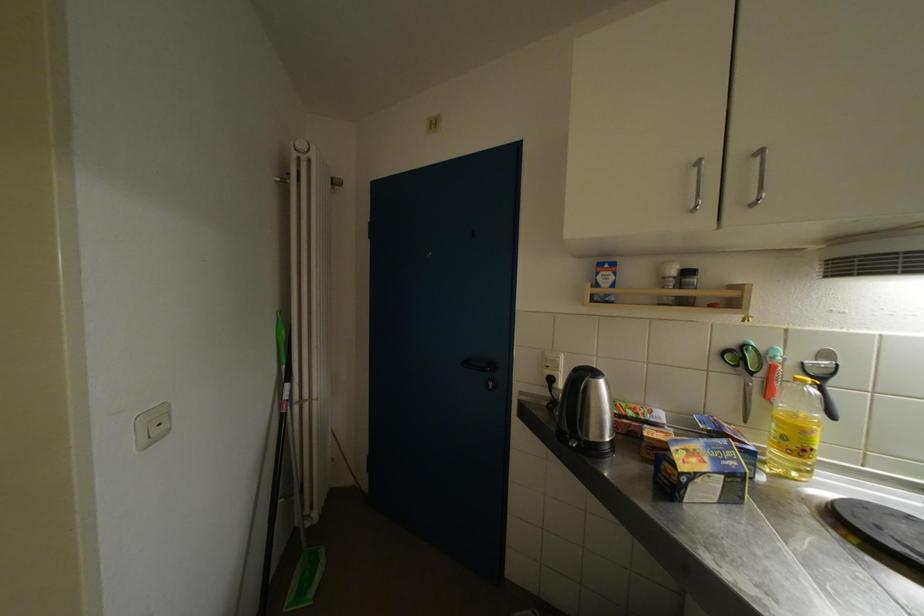
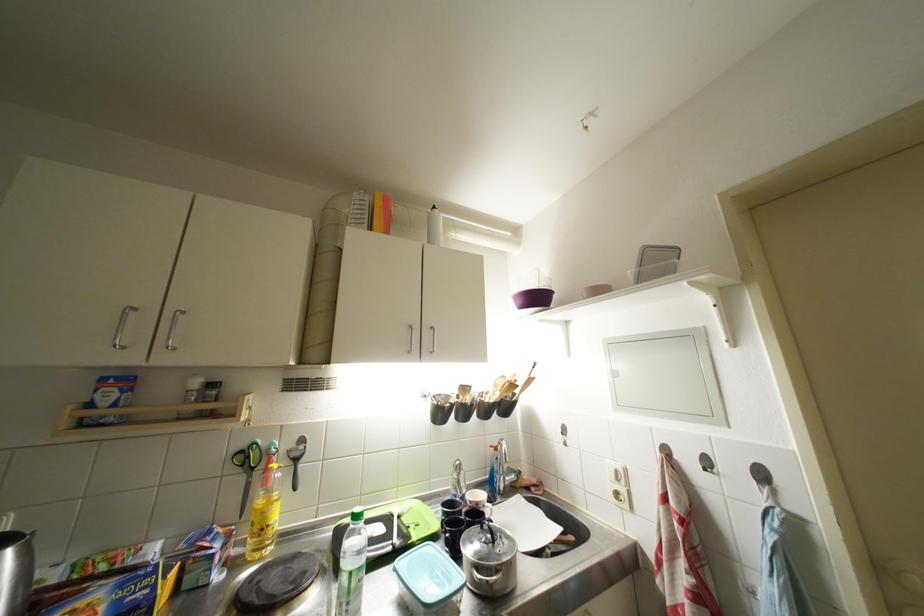
Where in the second image is the point corresponding to point 810,436 from the first image?

(271, 517)